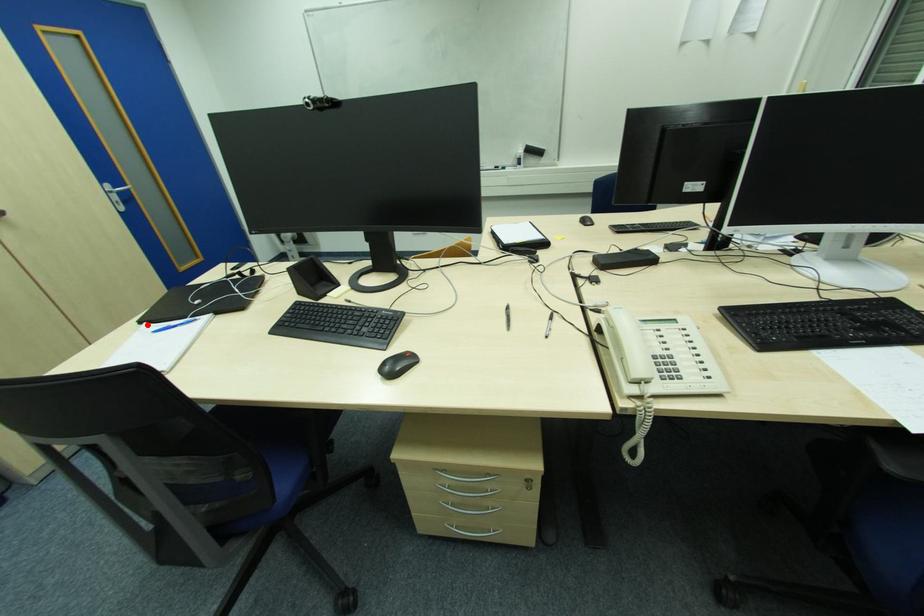
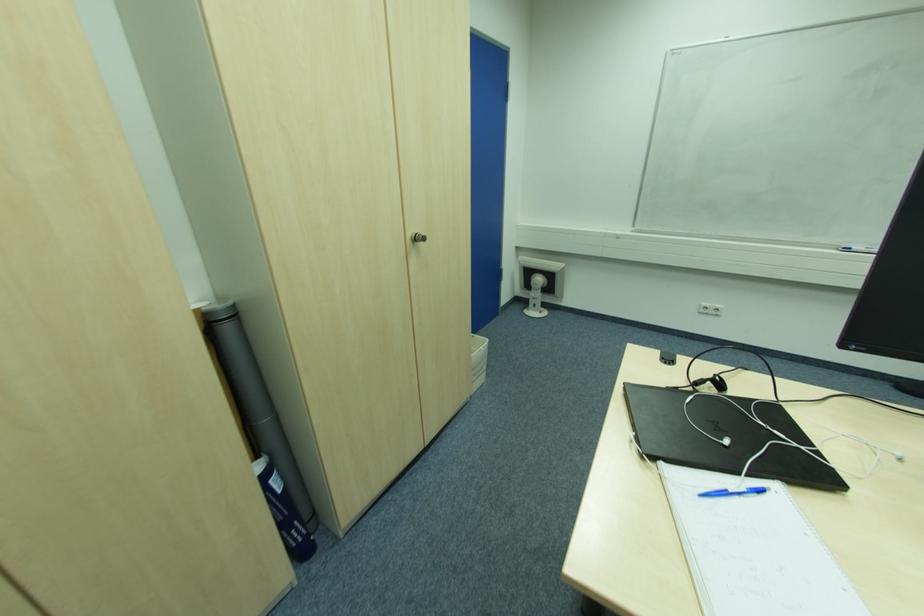
In the second image, find the point that corresponds to the highlighted location in the first image.

(663, 464)